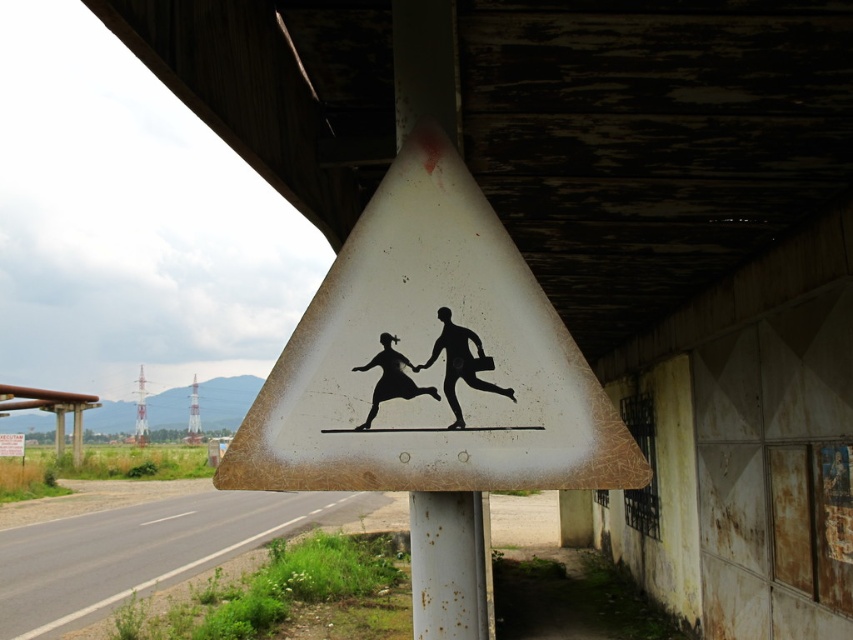
Question: Considering the relative positions of white matte sign at center and asphalt road at lower left in the image provided, where is white matte sign at center located with respect to asphalt road at lower left?

Choices:
 (A) left
 (B) right

Answer: (B)

Question: Where is white matte sign at center located in relation to asphalt road at lower left in the image?

Choices:
 (A) above
 (B) below

Answer: (A)

Question: Which object appears farthest from the camera in this image?

Choices:
 (A) white matte sign at center
 (B) rusty metal pole at center
 (C) black matte figure at center

Answer: (B)

Question: Among these objects, which one is farthest from the camera?

Choices:
 (A) rusty metal pole at center
 (B) white matte sign at center

Answer: (A)

Question: From the image, what is the correct spatial relationship of asphalt road at lower left in relation to black matte figure at center?

Choices:
 (A) left
 (B) right

Answer: (A)

Question: Which point is closer to the camera?

Choices:
 (A) (398, 392)
 (B) (450, 524)

Answer: (A)